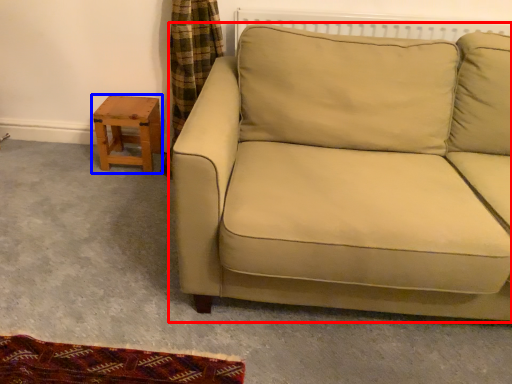
Question: Which object is further to the camera taking this photo, studio couch (highlighted by a red box) or table (highlighted by a blue box)?

Choices:
 (A) studio couch
 (B) table

Answer: (B)